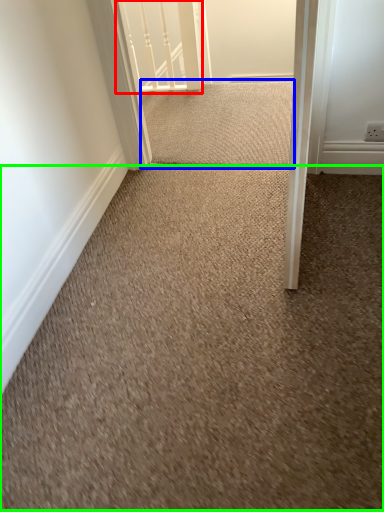
Question: Which object is the closest to the rail (highlighted by a red box)? Choose among these: doormat (highlighted by a blue box) or granite (highlighted by a green box).

Choices:
 (A) doormat
 (B) granite

Answer: (A)